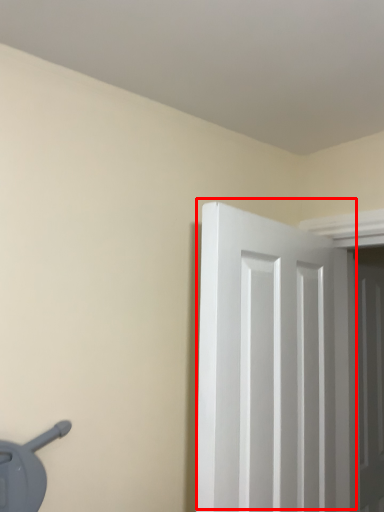
Question: From the image, what is the correct spatial relationship of door (annotated by the red box) in relation to door?

Choices:
 (A) right
 (B) left

Answer: (B)